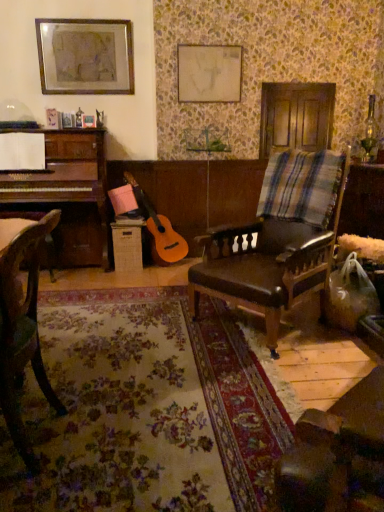
Where is `empty space that is ontop of metallic silver picture frame at upper left, which ranks as the first picture frame in left-to-right order (from a real-world perspective)`? empty space that is ontop of metallic silver picture frame at upper left, which ranks as the first picture frame in left-to-right order (from a real-world perspective) is located at coordinates (92, 14).